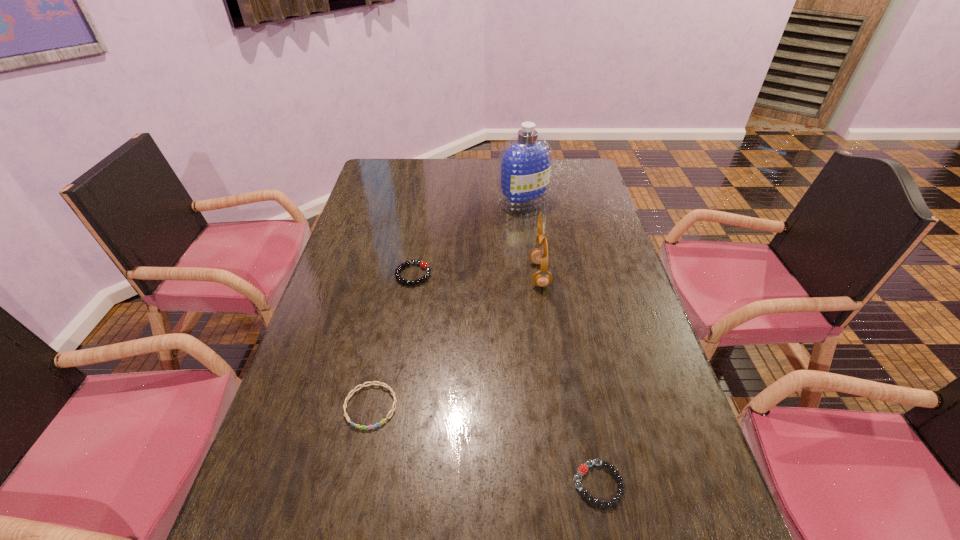
Find the location of a particular element. This screenshot has width=960, height=540. the farthest object is located at coordinates (525, 162).

Find the location of a particular element. Image resolution: width=960 pixels, height=540 pixels. the tallest object is located at coordinates (525, 162).

I want to click on the second tallest object, so point(539,255).

Locate an element on the screen. the farthest bracelet is located at coordinates (424, 265).

Find the location of a particular element. This screenshot has height=540, width=960. the second nearest object is located at coordinates (392, 410).

Identify the location of the nearest object. Image resolution: width=960 pixels, height=540 pixels. click(x=583, y=468).

Identify the location of the rightmost bracelet. Image resolution: width=960 pixels, height=540 pixels. (583, 468).

Image resolution: width=960 pixels, height=540 pixels. Identify the location of blank space located 0.090m on the front of the cleansing agent. (526, 229).

Image resolution: width=960 pixels, height=540 pixels. Identify the location of vacant space located 0.180m on the front-facing side of the second tallest object. (470, 275).

Where is `free space located 0.390m on the front-facing side of the second tallest object`? free space located 0.390m on the front-facing side of the second tallest object is located at coordinates (400, 275).